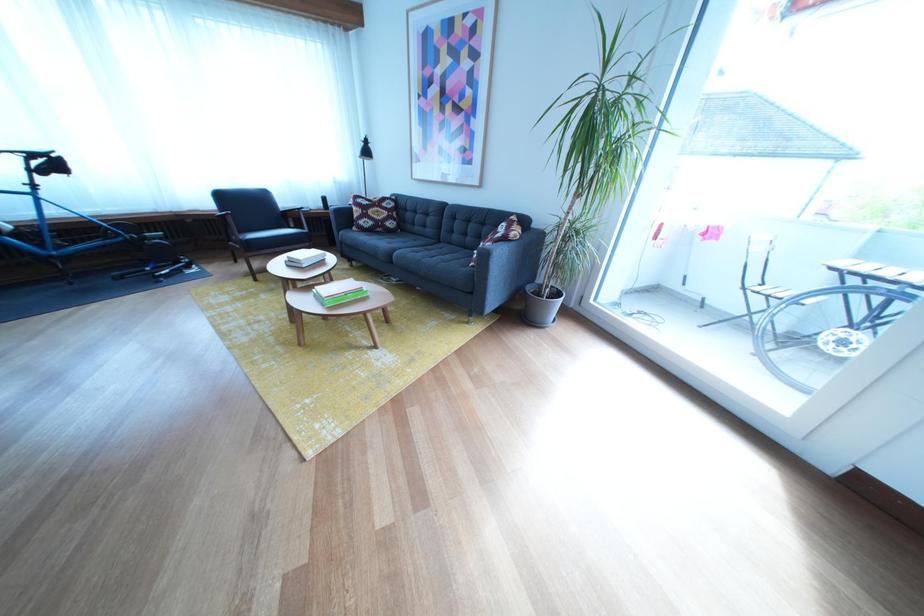
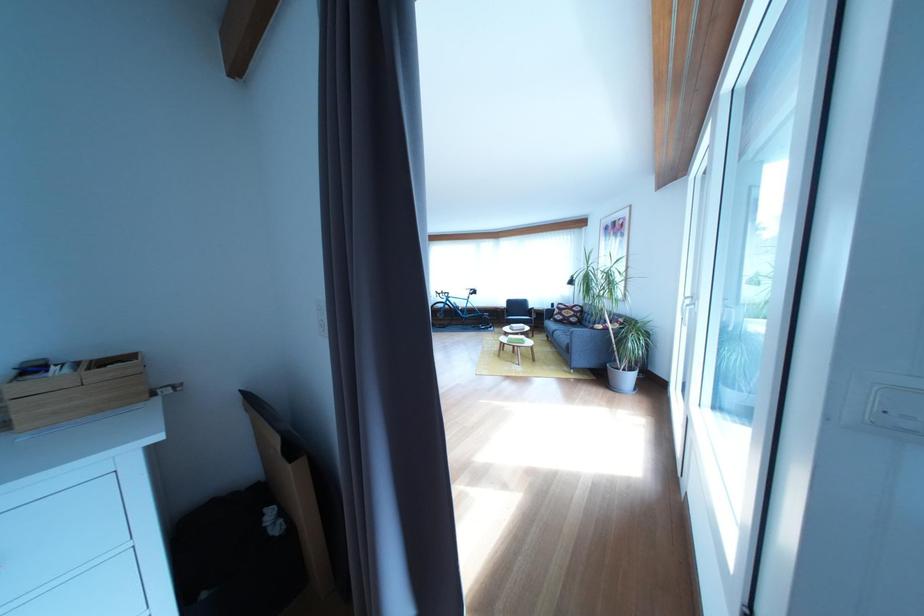
In the second image, find the point that corresponds to (383,229) in the first image.

(575, 323)